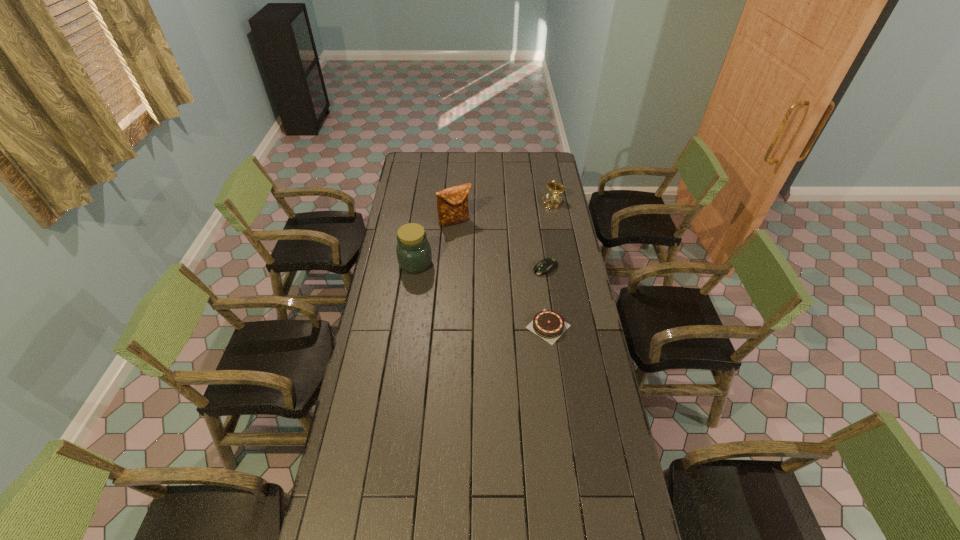
You are a GUI agent. You are given a task and a screenshot of the screen. Output one action in this format:
    pyautogui.click(x=<x>, y=<y>)
    Task: Click on the free space located 0.140m on the open side of the clutch bag
    
    Given the screenshot: What is the action you would take?
    pyautogui.click(x=469, y=245)

This screenshot has width=960, height=540. Find the location of `free space located 0.130m on the open side of the clutch bag`. free space located 0.130m on the open side of the clutch bag is located at coordinates (469, 244).

You are a GUI agent. You are given a task and a screenshot of the screen. Output one action in this format:
    pyautogui.click(x=<x>, y=<y>)
    Task: Click on the vacant region located 0.090m on the wheel side of the computer mouse
    The height and width of the screenshot is (540, 960).
    Given the screenshot: What is the action you would take?
    pyautogui.click(x=521, y=282)

I want to click on vacant space situated 0.210m on the wheel side of the computer mouse, so click(500, 294).

Find the location of a particular element. Image resolution: width=960 pixels, height=540 pixels. vacant space situated on the wheel side of the computer mouse is located at coordinates (494, 297).

Locate an element on the screen. The image size is (960, 540). free space located with the dial facing the third tallest object is located at coordinates (541, 220).

Locate an element on the screen. The image size is (960, 540). free spot located with the dial facing the third tallest object is located at coordinates (519, 253).

Find the location of a particular element. Image resolution: width=960 pixels, height=540 pixels. free point located 0.160m with the dial facing the third tallest object is located at coordinates (538, 227).

I want to click on object at the left edge, so click(x=413, y=250).

Find the location of a particular element. chocolate cake situated at the right edge is located at coordinates (549, 325).